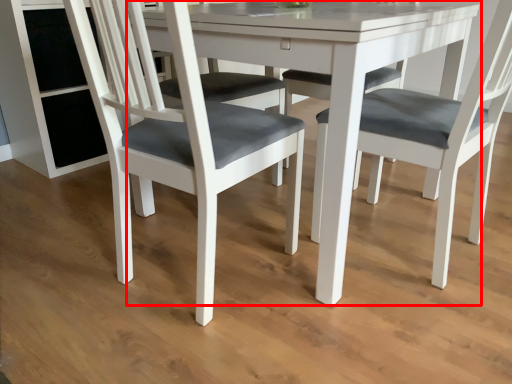
Question: From the image's perspective, where is round table (annotated by the red box) located in relation to chair in the image?

Choices:
 (A) above
 (B) below

Answer: (A)